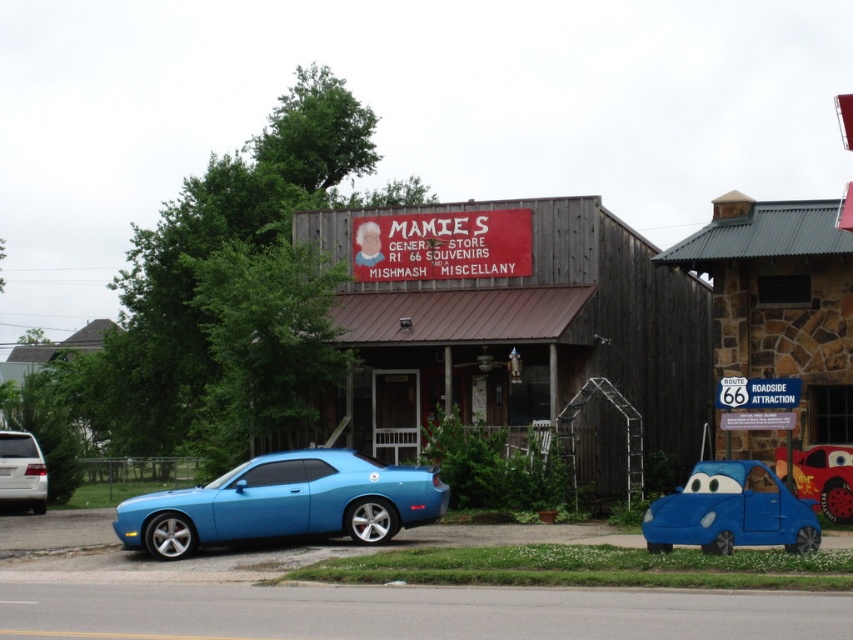
You are a tourist standing in front of the store and want to take a photo of the wooden signboard at center and the blue matte car at center. Which object should you position to your left to include both in the frame?

You should position the wooden signboard at center to your left since it is located to the left of the blue matte car at center.

Based on the photo, you are a tourist driving a car and you see the wooden signboard at center and the white matte van at left. Which object is higher from the ground?

The wooden signboard at center is above the white matte van at left, so the wooden signboard at center is higher from the ground.

You are standing at the entrance of Mamie s General Store and want to take a photo of the matte blue car at lower left. Which direction should you face to capture it in your shot?

The matte blue car at lower left is located at point (x=285, y=502), so you should face towards the lower left direction to capture it in your photo.